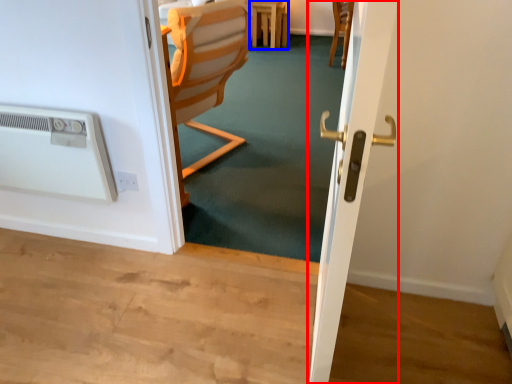
Question: Which point is closer to the camera, screen door (highlighted by a red box) or furniture (highlighted by a blue box)?

Choices:
 (A) screen door
 (B) furniture

Answer: (A)